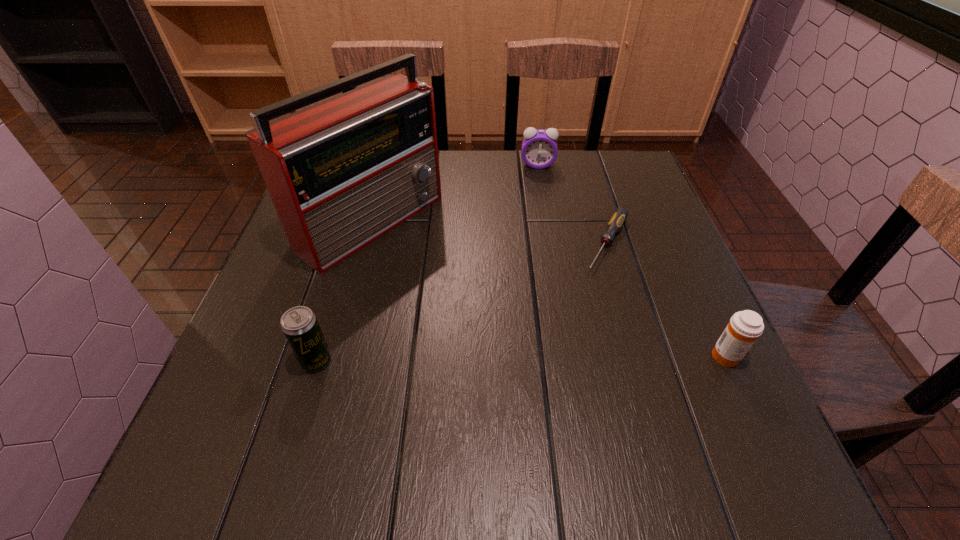
Locate an element on the screen. beer can at the left edge is located at coordinates (299, 324).

What are the coordinates of `radio receiver at the left edge` in the screenshot? It's located at (341, 173).

You are a GUI agent. You are given a task and a screenshot of the screen. Output one action in this format:
    pyautogui.click(x=<x>, y=<y>)
    Task: Click on the medicine that is positioned at the right edge
    
    Given the screenshot: What is the action you would take?
    pyautogui.click(x=744, y=328)

Locate an element on the screen. screwdriver positioned at the right edge is located at coordinates (620, 215).

Where is `object located at the far left corner`? object located at the far left corner is located at coordinates (341, 173).

This screenshot has width=960, height=540. I want to click on free space at the far edge, so click(x=458, y=156).

This screenshot has width=960, height=540. I want to click on vacant space at the near edge of the desktop, so click(478, 425).

I want to click on vacant space at the left edge of the desktop, so click(x=285, y=240).

Locate an element on the screen. The height and width of the screenshot is (540, 960). vacant space at the right edge is located at coordinates (673, 256).

The image size is (960, 540). Identify the location of vacant space at the near left corner of the desktop. (292, 377).